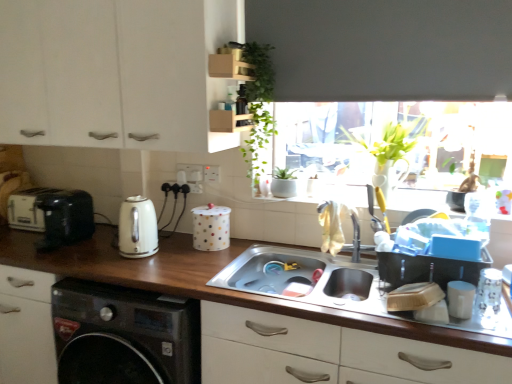
Identify the location of matte black toaster at left, which ranks as the third appliance in back-to-front order. (65, 218).

This screenshot has width=512, height=384. What are the coordinates of `stainless steel sink at center` in the screenshot? It's located at (311, 280).

Where is `matte black bottle at upper center`? matte black bottle at upper center is located at coordinates (241, 100).

Measure the distance between stainless steel sink at center and silver metallic faucet at sink center.

The distance of stainless steel sink at center from silver metallic faucet at sink center is 10.38 inches.

Does stainless steel sink at center turn towards silver metallic faucet at sink center?

No, stainless steel sink at center is not oriented towards silver metallic faucet at sink center.

Is silver metallic faucet at sink center a part of stainless steel sink at center?

No, silver metallic faucet at sink center is not a part of stainless steel sink at center.

You are a GUI agent. You are given a task and a screenshot of the screen. Output one action in this format:
    pyautogui.click(x=<x>, y=<y>)
    Task: Click on the sink in front of the silver metallic faucet at sink center
    This screenshot has width=512, height=384.
    Given the screenshot: What is the action you would take?
    pyautogui.click(x=311, y=280)

Could you tell me if white polka dot container at center, the third appliance from the left, is turned towards matte black toaster at left, positioned as the second appliance in left-to-right order?

No, white polka dot container at center, the third appliance from the left, is not turned towards matte black toaster at left, positioned as the second appliance in left-to-right order.

Could you measure the distance between white polka dot container at center, the third appliance from the left, and matte black toaster at left, positioned as the second appliance in left-to-right order?

24.85 inches.

Based on the photo, is white polka dot container at center, the third appliance from the left, in contact with matte black toaster at left, which is the second appliance in front-to-back order?

white polka dot container at center, the third appliance from the left, is not next to matte black toaster at left, which is the second appliance in front-to-back order, and they're not touching.

Between point (224, 224) and point (48, 201), which one is positioned behind?

The point (48, 201) is more distant.

Is matte black bottle at upper center at the left side of white polka dot container at center, which ranks as the third appliance in front-to-back order?

Incorrect, matte black bottle at upper center is not on the left side of white polka dot container at center, which ranks as the third appliance in front-to-back order.

Which is in front, matte black bottle at upper center or white polka dot container at center, which ranks as the third appliance in front-to-back order?

matte black bottle at upper center is more forward.

Is white polka dot container at center, arranged as the second appliance when viewed from the back, at the back of matte black bottle at upper center?

No, matte black bottle at upper center is not facing the opposite direction of white polka dot container at center, arranged as the second appliance when viewed from the back.

How many degrees apart are the facing directions of matte black bottle at upper center and white polka dot container at center, which ranks as the third appliance in front-to-back order?

The facing directions of matte black bottle at upper center and white polka dot container at center, which ranks as the third appliance in front-to-back order, are 90 degrees apart.

Does white plastic toaster at left, the 1th appliance when ordered from back to front, touch wooden at lower center?

They are not placed beside each other.

Is the position of white plastic toaster at left, which is the first appliance in left-to-right order, less distant than that of wooden at lower center?

That is False.

Between point (15, 214) and point (26, 251), which one is positioned behind?

Positioned behind is point (15, 214).

Could you measure the distance between white plastic toaster at left, the 1th appliance when ordered from back to front, and wooden at lower center?

A distance of 17.81 inches exists between white plastic toaster at left, the 1th appliance when ordered from back to front, and wooden at lower center.

Could you tell me if wooden at lower center is facing green leafy plant at upper center?

No, wooden at lower center is not aimed at green leafy plant at upper center.

Between point (108, 272) and point (250, 97), which one is positioned in front?

Positioned in front is point (108, 272).

From a real-world perspective, which is physically above, wooden at lower center or green leafy plant at upper center?

green leafy plant at upper center is physically above.

Visually, is wooden at lower center positioned to the left or to the right of green leafy plant at upper center?

In the image, wooden at lower center appears on the left side of green leafy plant at upper center.

Considering their positions, is green leafy plant at upper center located in front of or behind matte black toaster at left, positioned as the second appliance in left-to-right order?

Clearly, green leafy plant at upper center is in front of matte black toaster at left, positioned as the second appliance in left-to-right order.

Is green leafy plant at upper center not near matte black toaster at left, which is the second appliance in front-to-back order?

No, there isn't a large distance between green leafy plant at upper center and matte black toaster at left, which is the second appliance in front-to-back order.

From a real-world perspective, is green leafy plant at upper center beneath matte black toaster at left, the third appliance viewed from the right?

Actually, green leafy plant at upper center is physically above matte black toaster at left, the third appliance viewed from the right, in the real world.

Would you say matte black toaster at left, which is the second appliance in front-to-back order, contains white matte cabinet at upper left?

Actually, white matte cabinet at upper left is outside matte black toaster at left, which is the second appliance in front-to-back order.

Which object is positioned more to the right, matte black toaster at left, which ranks as the third appliance in back-to-front order, or white matte cabinet at upper left?

From the viewer's perspective, white matte cabinet at upper left appears more on the right side.

Find the location of a particular element. The image size is (512, 384). cabinetry in front of the matte black toaster at left, which ranks as the third appliance in back-to-front order is located at coordinates (114, 72).

You are a GUI agent. You are given a task and a screenshot of the screen. Output one action in this format:
    pyautogui.click(x=<x>, y=<y>)
    Task: Click on the tap above the stainless steel sink at center (from a real-world perspective)
    The image size is (512, 384).
    Given the screenshot: What is the action you would take?
    pyautogui.click(x=356, y=240)

I want to click on the 1st appliance counting from the right of the matte black toaster at left, which ranks as the third appliance in back-to-front order, so click(211, 227).

In the scene shown: Considering their positions, is matte black bottle at upper center positioned further to green leafy plant at upper center than white matte cabinet at upper left?

The object further to green leafy plant at upper center is white matte cabinet at upper left.

From the image, which object appears to be nearer to matte black bottle at upper center, white glossy kettle at left or silver metallic faucet at sink center?

A: Based on the image, white glossy kettle at left appears to be nearer to matte black bottle at upper center.

Looking at the image, which one is located further to white matte cup at lower right, the 1th appliance positioned from the front, white plastic toaster at left, which is the first appliance in left-to-right order, or white matte cabinet at upper left?

white plastic toaster at left, which is the first appliance in left-to-right order, is positioned further to the anchor white matte cup at lower right, the 1th appliance positioned from the front.

When comparing their distances from white plastic toaster at left, which is the first appliance in left-to-right order, does silver metallic faucet at sink center or white polka dot container at center, which is counted as the 2th appliance, starting from the right, seem closer?

Based on the image, white polka dot container at center, which is counted as the 2th appliance, starting from the right, appears to be nearer to white plastic toaster at left, which is the first appliance in left-to-right order.

Which object lies nearer to the anchor point white glossy kettle at left, white matte cup at lower right, arranged as the 4th appliance when viewed from the left, or wooden at lower center?

wooden at lower center is closer to white glossy kettle at left.

From the image, which object appears to be farther from wooden at lower center, green leafy plant at upper center or white polka dot container at center, arranged as the second appliance when viewed from the back?

Among the two, green leafy plant at upper center is located further to wooden at lower center.

Which object lies further to the anchor point green leafy plant at upper center, stainless steel sink at center or white matte cup at lower right, positioned as the fourth appliance in back-to-front order?

Based on the image, white matte cup at lower right, positioned as the fourth appliance in back-to-front order, appears to be further to green leafy plant at upper center.

Looking at the image, which one is located closer to matte black bottle at upper center, wooden at lower center or green leafy plant at upper center?

green leafy plant at upper center is closer to matte black bottle at upper center.

I want to click on plant between matte black bottle at upper center and white matte cup at lower right, the 1th appliance positioned from the front, vertically, so click(258, 104).

Image resolution: width=512 pixels, height=384 pixels. Find the location of `sink situated between white matte cabinet at upper left and green leafy plant at upper center from left to right`. sink situated between white matte cabinet at upper left and green leafy plant at upper center from left to right is located at coordinates (311, 280).

Locate an element on the screen. Image resolution: width=512 pixels, height=384 pixels. appliance between white glossy kettle at left and green leafy plant at upper center is located at coordinates (211, 227).

Where is `plant between matte black bottle at upper center and silver metallic faucet at sink center vertically`? plant between matte black bottle at upper center and silver metallic faucet at sink center vertically is located at coordinates point(258,104).